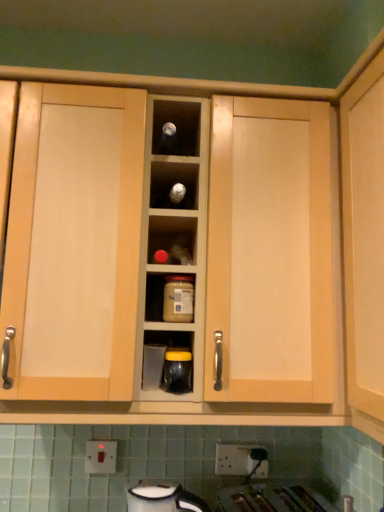
Question: Is white plastic electric outlet at lower center, which appears as the 2th electric outlet when viewed from the left, bigger than matte glass jar at center?

Choices:
 (A) no
 (B) yes

Answer: (A)

Question: Is white plastic electric outlet at lower center, which appears as the 2th electric outlet when viewed from the left, positioned with its back to matte glass jar at center?

Choices:
 (A) yes
 (B) no

Answer: (B)

Question: Is white plastic electric outlet at lower center, which appears as the 2th electric outlet when viewed from the left, far from matte glass jar at center?

Choices:
 (A) yes
 (B) no

Answer: (B)

Question: Is white plastic electric outlet at lower center, which appears as the first electric outlet when viewed from the right, with matte glass jar at center?

Choices:
 (A) yes
 (B) no

Answer: (B)

Question: Considering the relative sizes of white plastic electric outlet at lower center, which appears as the first electric outlet when viewed from the right, and matte glass jar at center in the image provided, is white plastic electric outlet at lower center, which appears as the first electric outlet when viewed from the right, smaller than matte glass jar at center?

Choices:
 (A) yes
 (B) no

Answer: (A)

Question: In terms of size, does light wood cabinet at center appear bigger or smaller than white glossy kettle at lower center, placed as the 1th appliance when sorted from bottom to top?

Choices:
 (A) small
 (B) big

Answer: (B)

Question: Is light wood cabinet at center in front of or behind white glossy kettle at lower center, placed as the 1th appliance when sorted from bottom to top, in the image?

Choices:
 (A) behind
 (B) front

Answer: (B)

Question: From the image's perspective, is light wood cabinet at center above or below white glossy kettle at lower center, the third appliance in the top-to-bottom sequence?

Choices:
 (A) below
 (B) above

Answer: (B)

Question: Is point (367, 139) closer or farther from the camera than point (168, 480)?

Choices:
 (A) closer
 (B) farther

Answer: (A)

Question: Is light wood cabinet at center wider or thinner than white plastic electric outlet at lower center, which appears as the first electric outlet when viewed from the right?

Choices:
 (A) thin
 (B) wide

Answer: (B)

Question: Considering the positions of point (382, 282) and point (215, 470), is point (382, 282) closer or farther from the camera than point (215, 470)?

Choices:
 (A) farther
 (B) closer

Answer: (B)

Question: Looking at the image, does light wood cabinet at center seem bigger or smaller compared to white plastic electric outlet at lower center, which appears as the 2th electric outlet when viewed from the left?

Choices:
 (A) small
 (B) big

Answer: (B)

Question: Is light wood cabinet at center in front of or behind white plastic electric outlet at lower center, which appears as the first electric outlet when viewed from the right, in the image?

Choices:
 (A) front
 (B) behind

Answer: (A)

Question: Considering the positions of point (187, 359) and point (107, 445), is point (187, 359) closer or farther from the camera than point (107, 445)?

Choices:
 (A) farther
 (B) closer

Answer: (B)

Question: Considering the positions of black glossy jar at center, positioned as the third appliance in bottom-to-top order, and white plastic electric outlet at lower center, which ranks as the 2th electric outlet in right-to-left order, in the image, is black glossy jar at center, positioned as the third appliance in bottom-to-top order, wider or thinner than white plastic electric outlet at lower center, which ranks as the 2th electric outlet in right-to-left order,?

Choices:
 (A) wide
 (B) thin

Answer: (A)